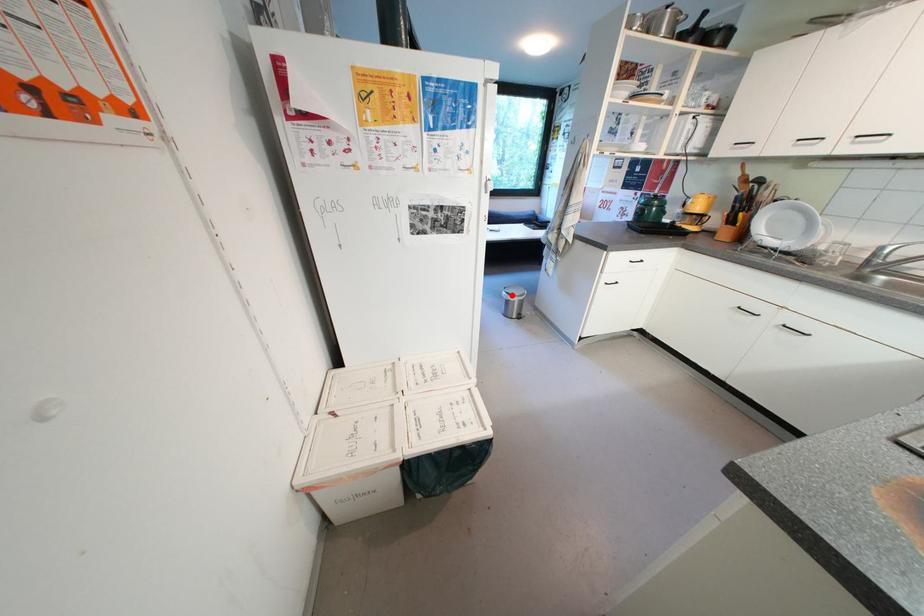
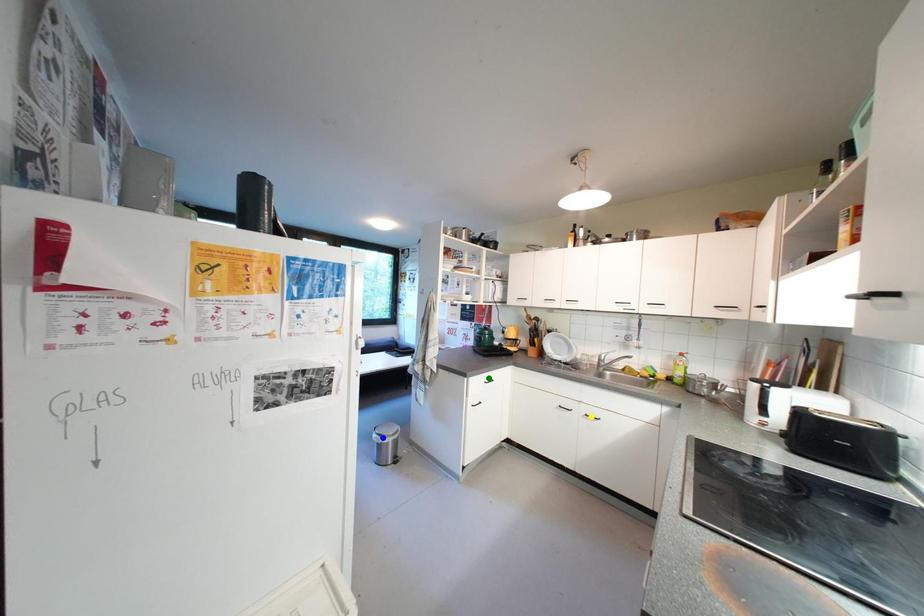
Question: I am providing you with two images of the same scene from different viewpoints. A red point is marked on the first image. You are given multiple points on the second image. Which point in image 2 is actually the same real-world point as the red point in image 1?

Choices:
 (A) yellow point
 (B) green point
 (C) blue point

Answer: (C)